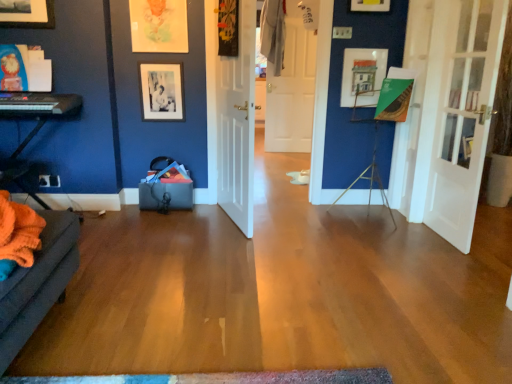
Where is `free point below white wooden door at center, which ranks as the second door in front-to-back order (from a real-world perspective)`? Image resolution: width=512 pixels, height=384 pixels. free point below white wooden door at center, which ranks as the second door in front-to-back order (from a real-world perspective) is located at coordinates (227, 222).